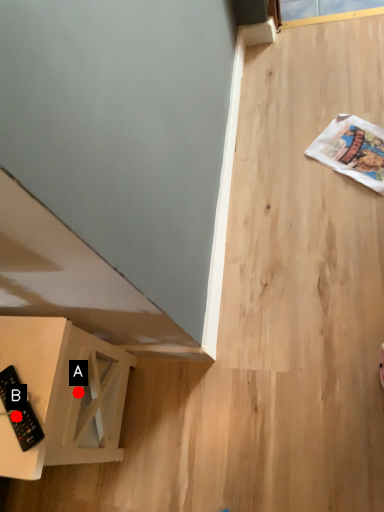
Question: Two points are circled on the image, labeled by A and B beside each circle. Which point is further to the camera?

Choices:
 (A) A is further
 (B) B is further

Answer: (A)